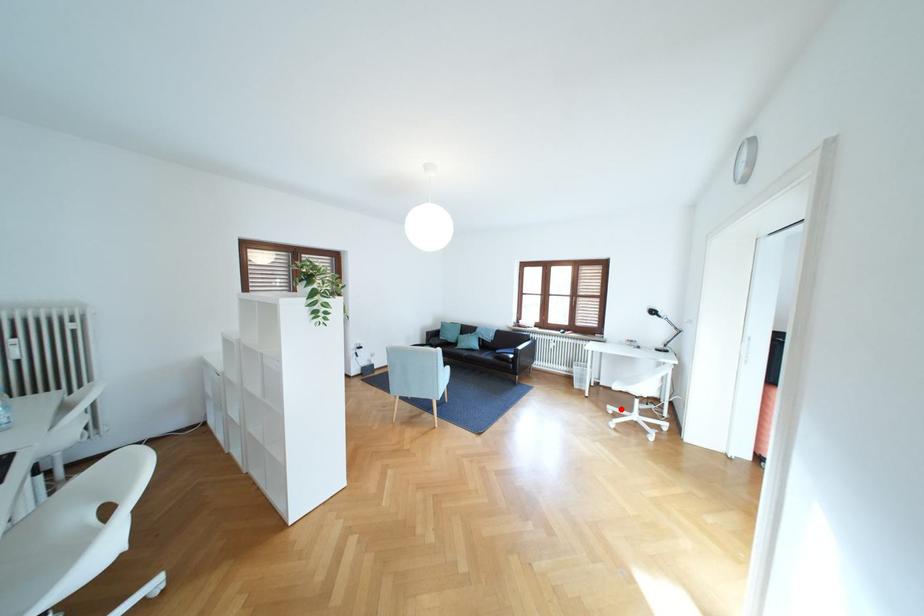
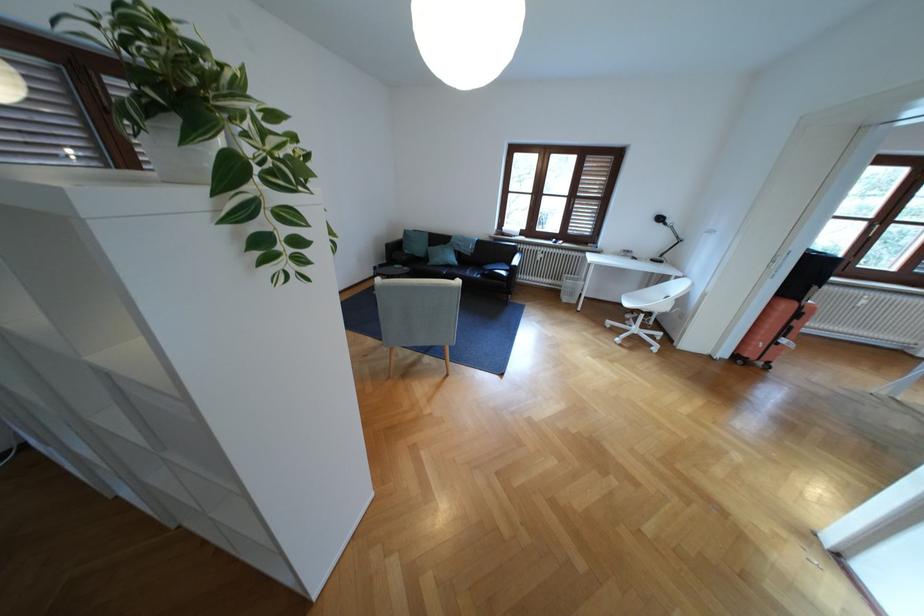
Where in the second image is the point corresponding to the highlighted location from the first image?

(618, 323)